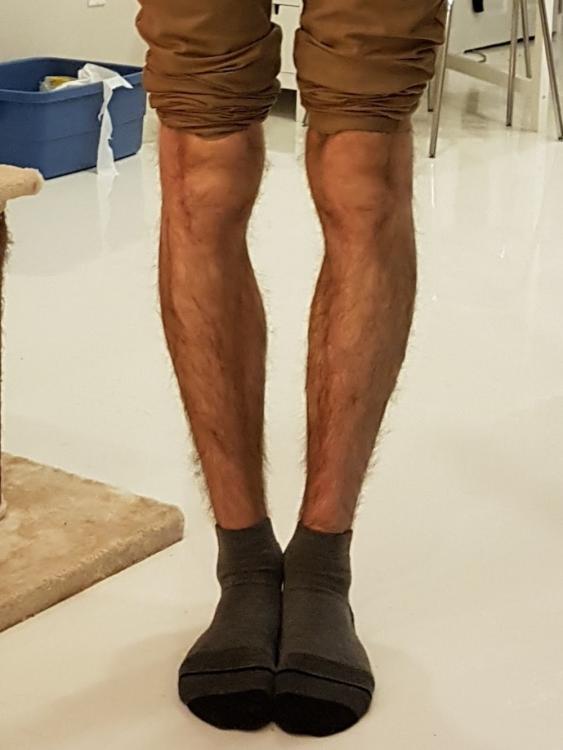
Find the location of `carpet on a cat scratcher`. carpet on a cat scratcher is located at coordinates (19, 184).